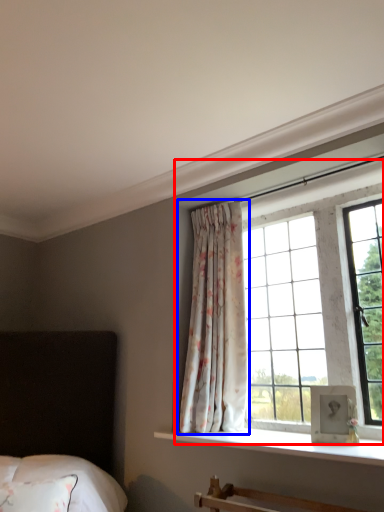
Question: Among these objects, which one is farthest to the camera, bay window (highlighted by a red box) or curtain (highlighted by a blue box)?

Choices:
 (A) bay window
 (B) curtain

Answer: (B)